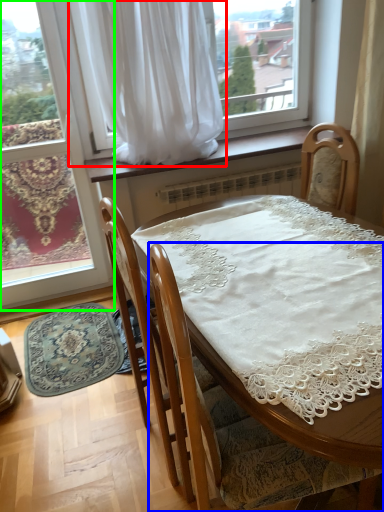
Question: Estimate the real-world distances between objects in this image. Which object is farther from curtain (highlighted by a red box), chair (highlighted by a blue box) or window (highlighted by a green box)?

Choices:
 (A) chair
 (B) window

Answer: (A)